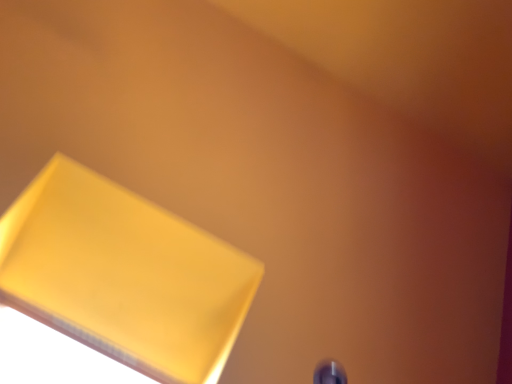
What do you see at coordinates (124, 275) in the screenshot? The image size is (512, 384). I see `matte yellow block at upper left` at bounding box center [124, 275].

Locate an element on the screen. matte yellow block at upper left is located at coordinates (124, 275).

Where is `matte yellow block at upper left`? The width and height of the screenshot is (512, 384). matte yellow block at upper left is located at coordinates (124, 275).